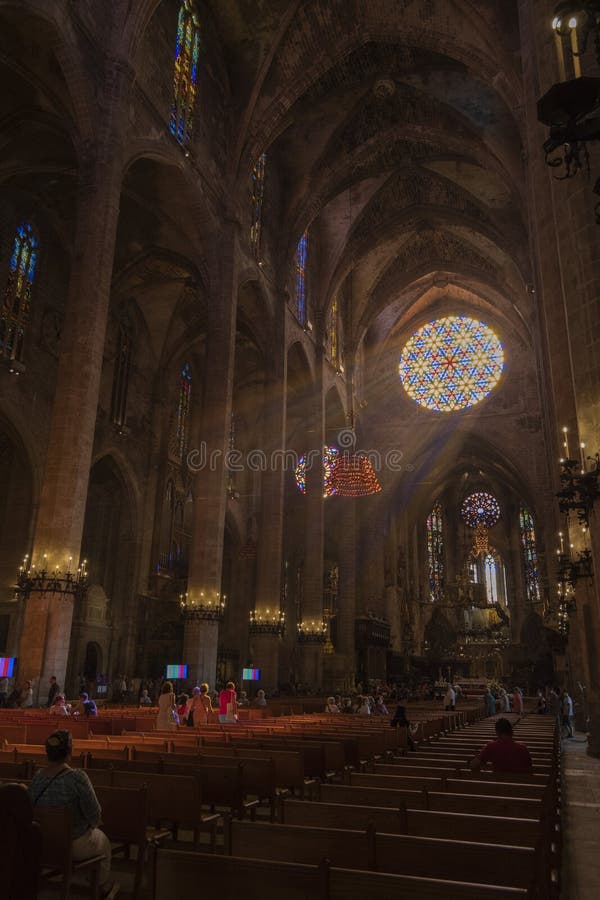
I want to click on stained glass windows, so click(x=536, y=542), click(x=430, y=544), click(x=178, y=75), click(x=27, y=255), click(x=263, y=186), click(x=304, y=247).